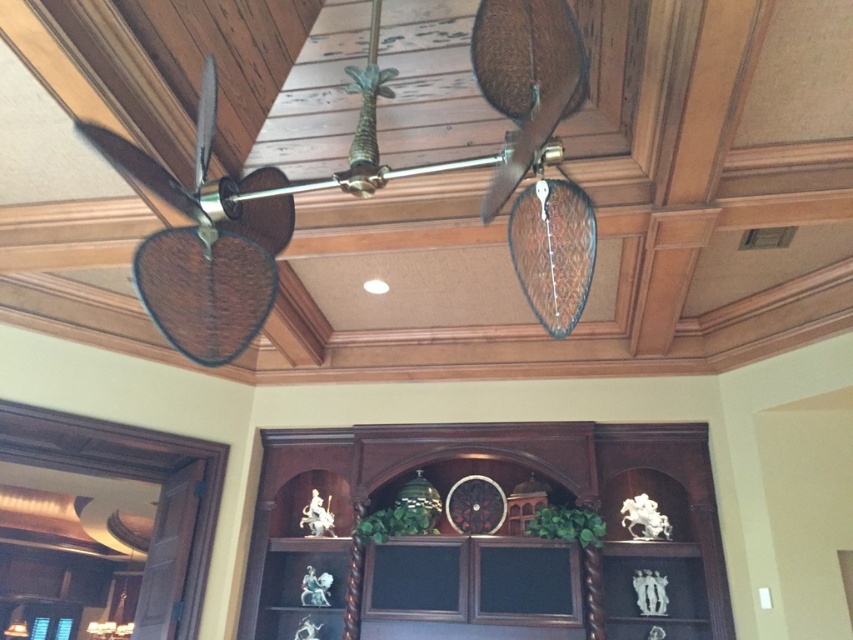
You are standing in the room and want to reach the brown woven fan at left. Considering your height is 1.68 meters, can you comfortably reach it without using a ladder?

The brown woven fan at left is 1.56 meters away from the viewer. Since your height is 1.68 meters, you can comfortably reach it without needing a ladder.